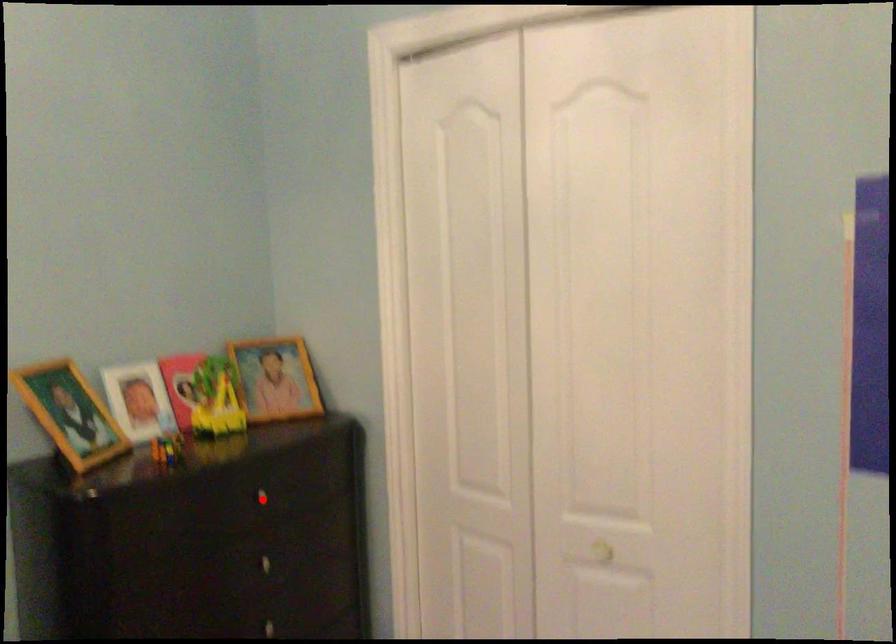
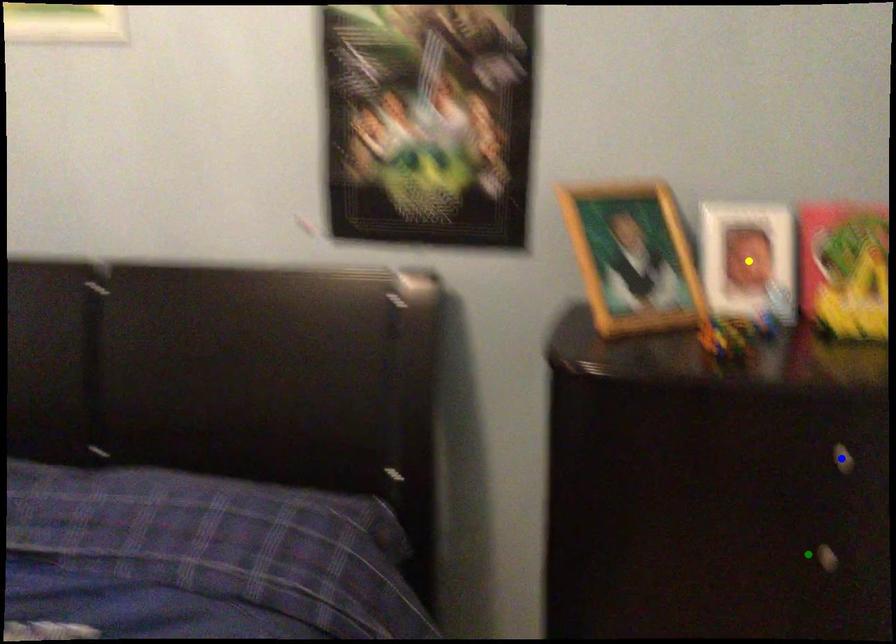
Question: I am providing you with two images of the same scene from different viewpoints. A red point is marked on the first image. You are given multiple points on the second image. In image 2, which mark is for the same physical point as the one in image 1?

Choices:
 (A) green point
 (B) yellow point
 (C) blue point

Answer: (C)